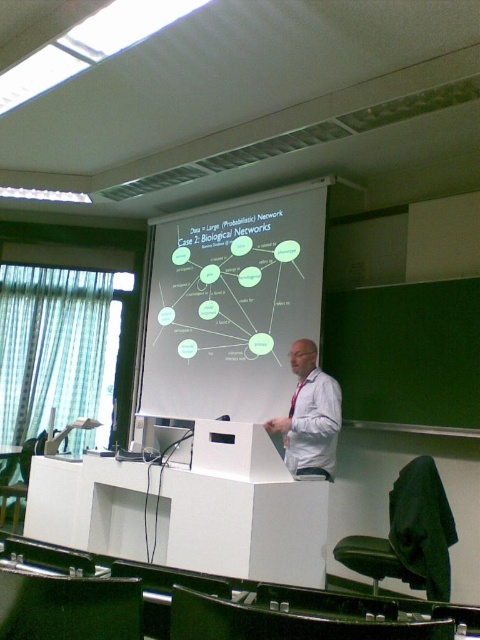
Question: Is white matte podium at center smaller than white shirt at center?

Choices:
 (A) yes
 (B) no

Answer: (B)

Question: Among these objects, which one is farthest from the camera?

Choices:
 (A) white shirt at center
 (B) white matte projection screen at center

Answer: (B)

Question: Does white matte podium at center appear under white shirt at center?

Choices:
 (A) no
 (B) yes

Answer: (B)

Question: Does white matte projection screen at center appear under white shirt at center?

Choices:
 (A) yes
 (B) no

Answer: (B)

Question: Which object is farther from the camera taking this photo?

Choices:
 (A) white shirt at center
 (B) white matte podium at center
 (C) white matte projection screen at center

Answer: (C)

Question: Which point appears closest to the camera in this image?

Choices:
 (A) (250, 568)
 (B) (290, 358)

Answer: (A)